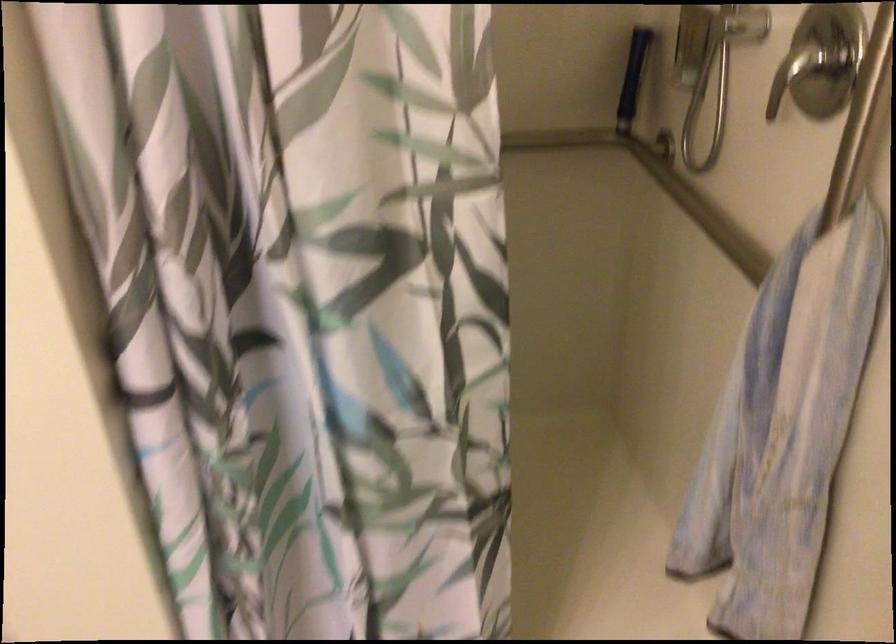
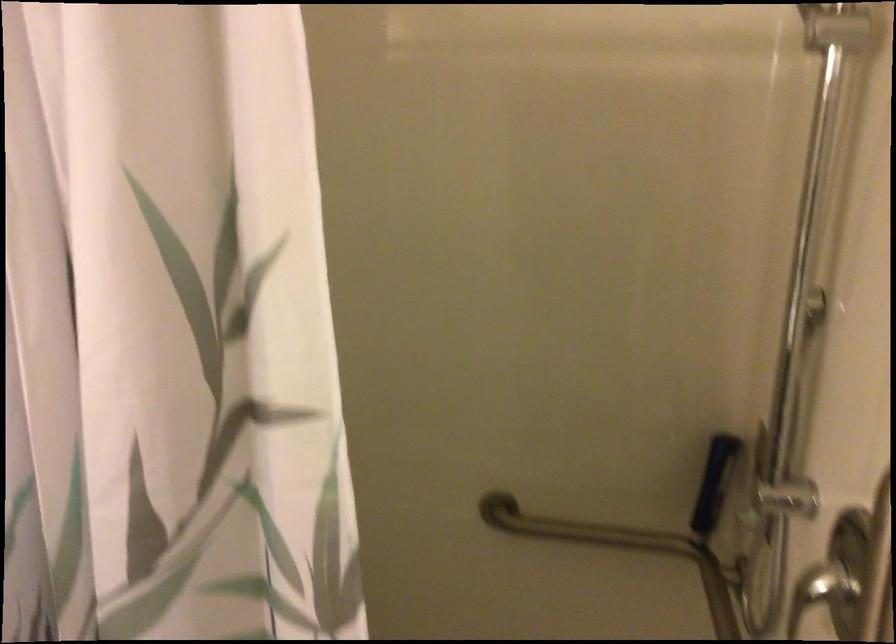
The point at (545,164) is marked in the first image. Where is the corresponding point in the second image?

(622, 549)